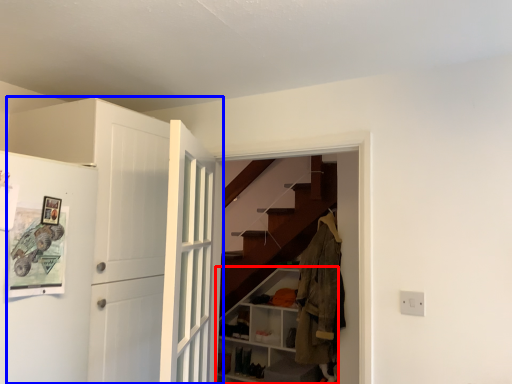
Question: Which object is further to the camera taking this photo, cabinetry (highlighted by a red box) or door (highlighted by a blue box)?

Choices:
 (A) cabinetry
 (B) door

Answer: (A)